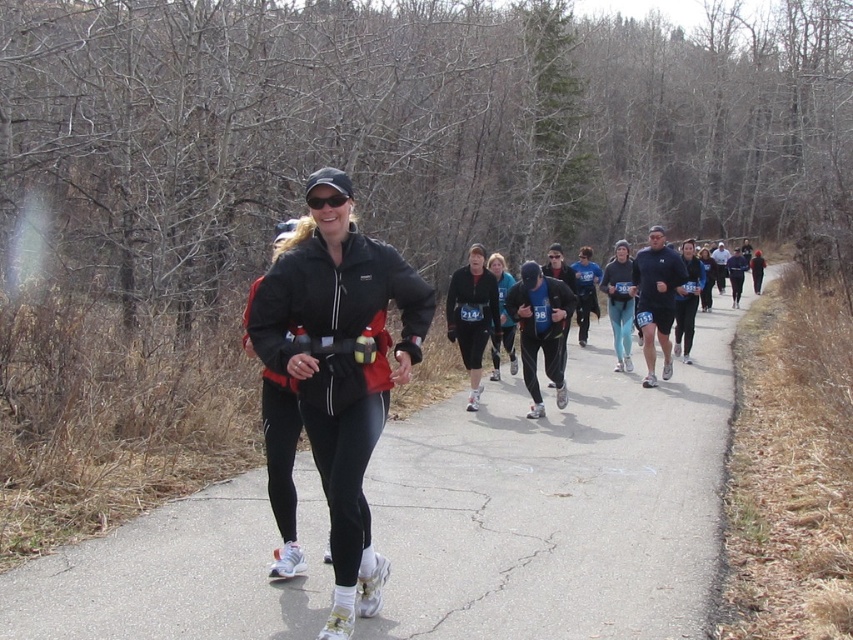
Is point (521, 312) in front of point (485, 253)?

That is True.

Is the position of blue fabric running outfit at center less distant than that of matte black jacket at center?

That is True.

Is point (676, 276) positioned before point (457, 321)?

No, it is behind (457, 321).

This screenshot has width=853, height=640. In order to click on blue fabric running outfit at center in this screenshot , I will do point(659,296).

Is black matte jacket at center shorter than matte black jacket at center?

In fact, black matte jacket at center may be taller than matte black jacket at center.

Can you confirm if black matte jacket at center is smaller than matte black jacket at center?

Incorrect, black matte jacket at center is not smaller in size than matte black jacket at center.

Describe the element at coordinates (340, 365) in the screenshot. The height and width of the screenshot is (640, 853). I see `black matte jacket at center` at that location.

The image size is (853, 640). What are the coordinates of `black matte jacket at center` in the screenshot? It's located at (340, 365).

Consider the image. Is black fabric runner at center positioned behind matte black jacket at center?

No, black fabric runner at center is closer to the viewer.

Where is `black fabric runner at center`? The image size is (853, 640). black fabric runner at center is located at coordinates (558, 506).